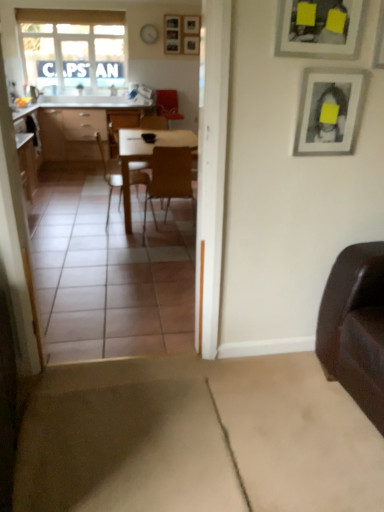
Question: Which direction should I rotate to look at wooden picture frame at upper center, placed as the 1th picture frame when sorted from top to bottom?

Choices:
 (A) right
 (B) left

Answer: (B)

Question: Is matte silver picture frame at upper right, arranged as the third picture frame when viewed from the left, beside wooden chair at center, which is counted as the 2th chair, starting from the right?

Choices:
 (A) no
 (B) yes

Answer: (A)

Question: Is matte silver picture frame at upper right, arranged as the third picture frame when viewed from the left, far from wooden chair at center, which is counted as the 2th chair, starting from the right?

Choices:
 (A) no
 (B) yes

Answer: (B)

Question: Is matte silver picture frame at upper right, arranged as the third picture frame when viewed from the left, at the right side of wooden chair at center, which is counted as the 2th chair, starting from the right?

Choices:
 (A) no
 (B) yes

Answer: (B)

Question: Is matte silver picture frame at upper right, the first picture frame positioned from the bottom, positioned before wooden chair at center, which ranks as the 1th chair in left-to-right order?

Choices:
 (A) no
 (B) yes

Answer: (B)

Question: Is matte silver picture frame at upper right, the first picture frame positioned from the bottom, taller than wooden chair at center, which is counted as the 2th chair, starting from the right?

Choices:
 (A) yes
 (B) no

Answer: (B)

Question: From the image's perspective, is matte silver picture frame at upper right, placed as the third picture frame when sorted from top to bottom, over wooden chair at center, which ranks as the 1th chair in left-to-right order?

Choices:
 (A) no
 (B) yes

Answer: (A)

Question: Is wooden table at center at the right side of matte silver picture frame at upper right, positioned as the 1th picture frame in right-to-left order?

Choices:
 (A) yes
 (B) no

Answer: (B)

Question: From a real-world perspective, does wooden table at center sit lower than matte silver picture frame at upper right, arranged as the third picture frame when viewed from the left?

Choices:
 (A) yes
 (B) no

Answer: (A)

Question: Does wooden table at center contain matte silver picture frame at upper right, positioned as the 1th picture frame in right-to-left order?

Choices:
 (A) no
 (B) yes

Answer: (A)

Question: Are wooden table at center and matte silver picture frame at upper right, positioned as the 1th picture frame in right-to-left order, far apart?

Choices:
 (A) yes
 (B) no

Answer: (A)

Question: Does wooden table at center have a lesser width compared to matte silver picture frame at upper right, which is counted as the second picture frame, starting from the front?

Choices:
 (A) no
 (B) yes

Answer: (A)

Question: Does wooden table at center have a larger size compared to matte silver picture frame at upper right, the second picture frame when ordered from back to front?

Choices:
 (A) no
 (B) yes

Answer: (B)

Question: Can you confirm if matte wood desk at center is wider than wooden at center, which is the second chair in left-to-right order?

Choices:
 (A) yes
 (B) no

Answer: (A)